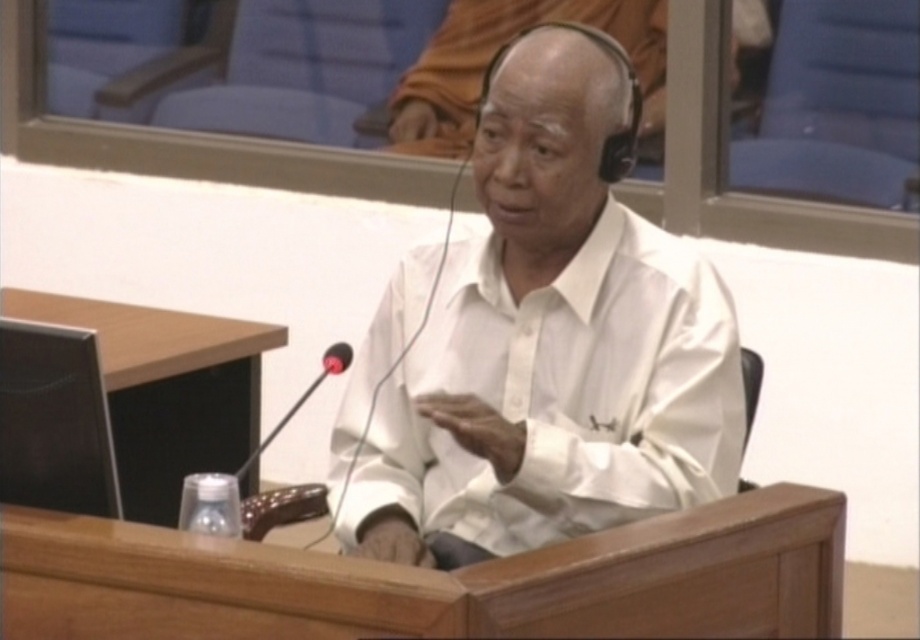
Question: Which point appears closest to the camera in this image?

Choices:
 (A) (595, 390)
 (B) (329, 356)
 (C) (345, 362)

Answer: (A)

Question: Can you confirm if black matte microphone at center is positioned to the right of black rubber microphone at center?

Choices:
 (A) no
 (B) yes

Answer: (B)

Question: Which object is farther from the camera taking this photo?

Choices:
 (A) white matte shirt at center
 (B) black matte microphone at center

Answer: (B)

Question: Is white matte shirt at center further to camera compared to black matte microphone at center?

Choices:
 (A) no
 (B) yes

Answer: (A)

Question: Can you confirm if white matte shirt at center is positioned above black rubber microphone at center?

Choices:
 (A) no
 (B) yes

Answer: (A)

Question: Considering the real-world distances, which object is closest to the black rubber microphone at center?

Choices:
 (A) white matte shirt at center
 (B) black matte microphone at center

Answer: (B)